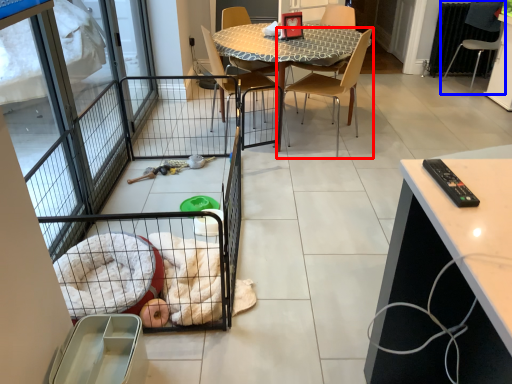
Question: Which of the following is the closest to the observer, chair (highlighted by a red box) or chair (highlighted by a blue box)?

Choices:
 (A) chair
 (B) chair

Answer: (A)